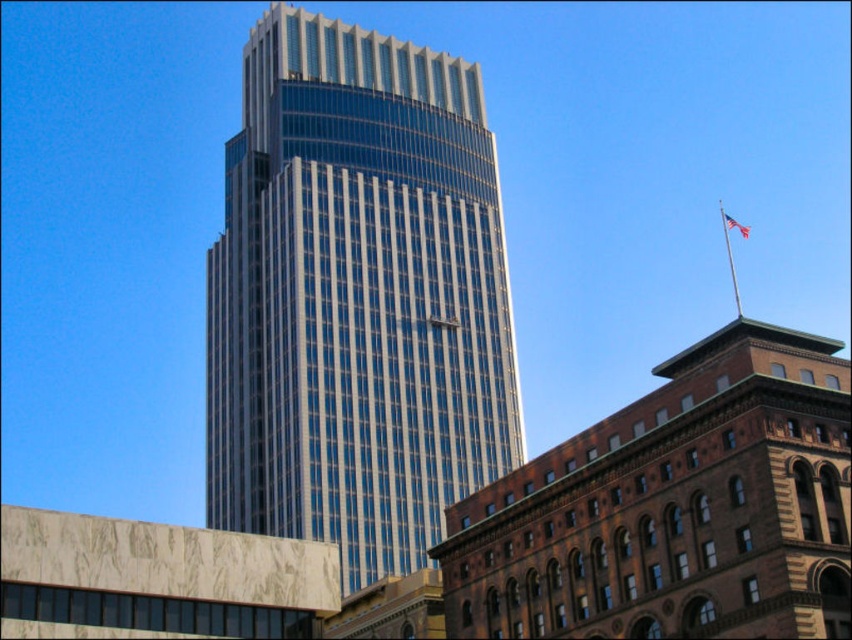
Question: Is glassy steel skyscraper at center wider than red fabric flag at upper right?

Choices:
 (A) yes
 (B) no

Answer: (A)

Question: Is glassy steel skyscraper at center positioned before red fabric flag at upper right?

Choices:
 (A) yes
 (B) no

Answer: (A)

Question: Is glassy steel skyscraper at center to the left of red fabric flag at upper right from the viewer's perspective?

Choices:
 (A) no
 (B) yes

Answer: (B)